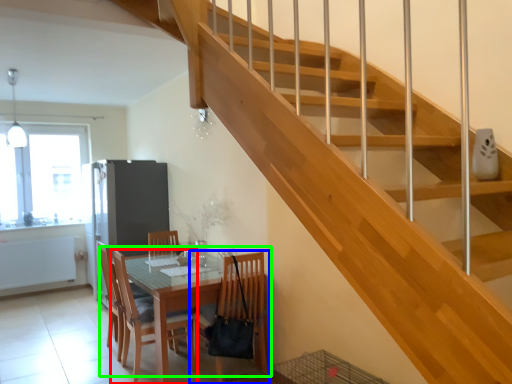
Question: Considering the real-world distances, which object is closest to chair (highlighted by a red box)? chair (highlighted by a blue box) or kitchen & dining room table (highlighted by a green box).

Choices:
 (A) chair
 (B) kitchen & dining room table

Answer: (B)